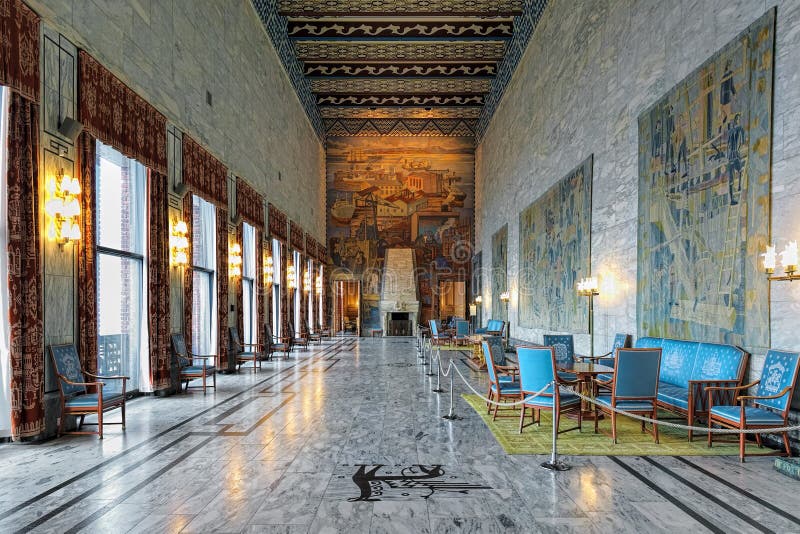
You are a GUI agent. You are given a task and a screenshot of the screen. Output one action in this format:
    pyautogui.click(x=<x>, y=<y>)
    Task: Click on the muraled wall
    Image resolution: width=800 pixels, height=534 pixels.
    Given the screenshot: What is the action you would take?
    pyautogui.click(x=404, y=195)